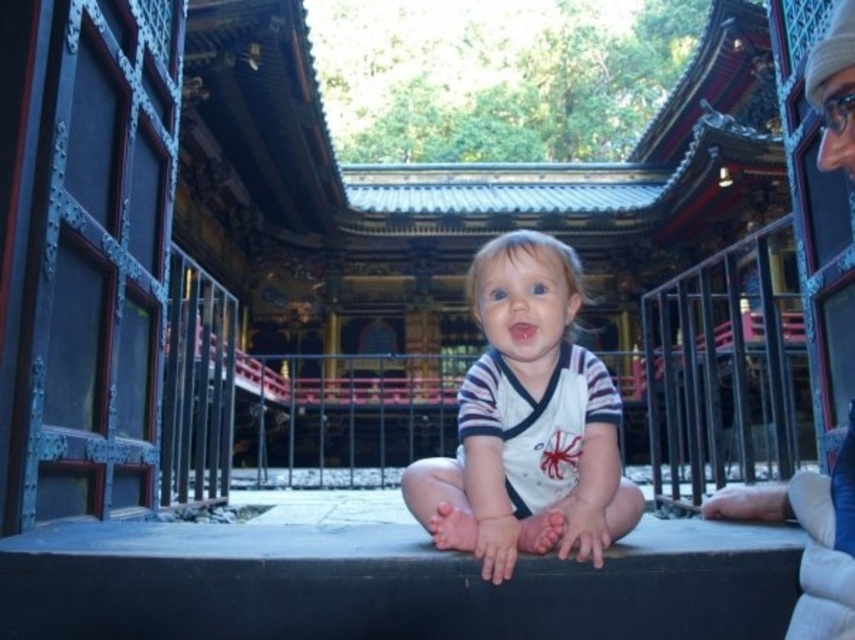
You are a photographer trying to capture the child in the temple courtyard. You notice the white cotton shirt at center and the white knit hat at upper right. Which object is bigger in size?

The white cotton shirt at center is larger in size compared to the white knit hat at upper right.

Based on the photo, you are a photographer setting up a tripod in the temple courtyard. You notice the white cotton shirt at center and the white knit hat at upper right. Which object should you adjust your camera angle to focus on if you want to capture the taller object?

The white knit hat at upper right is taller than the white cotton shirt at center, so you should adjust your camera angle to focus on the white knit hat at upper right to capture the taller object.

You are a photographer standing in the temple courtyard. You want to take a photo of the white cotton shirt at center. Where should you position yourself to capture the shirt at point (528, 422)?

To capture the white cotton shirt at center at point (528, 422), position yourself directly in front of the shirt at that coordinate.